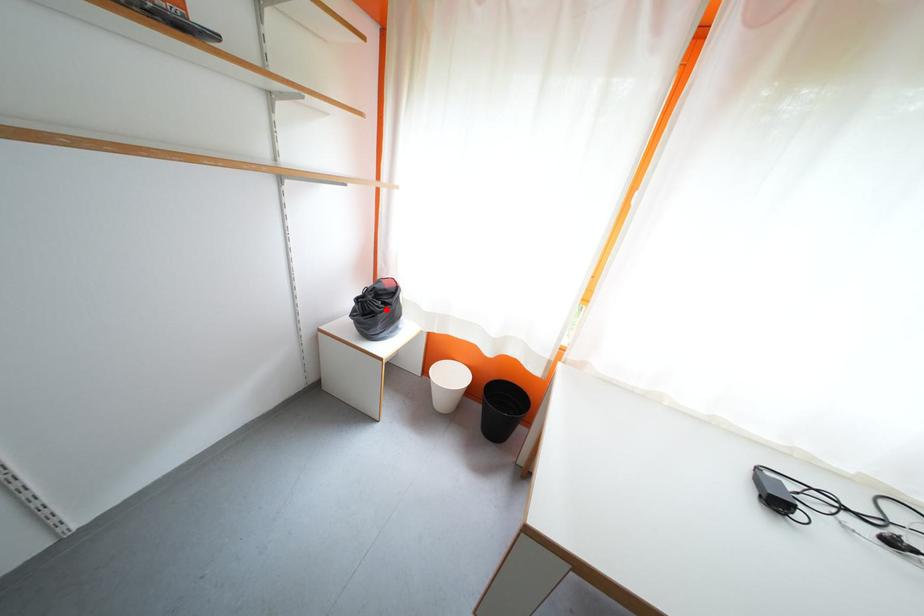
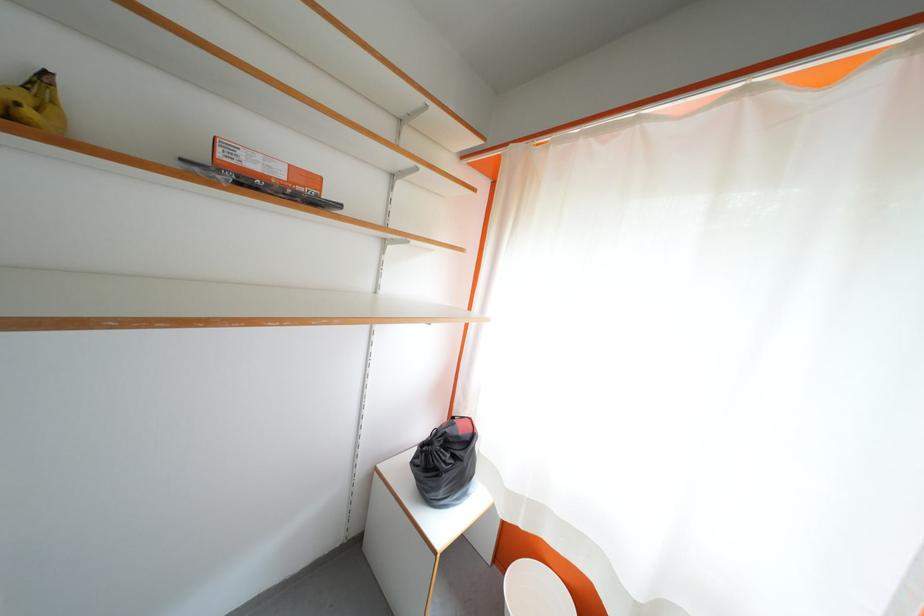
Question: A red point is marked in image1. In image2, is the corresponding 3D point closer to the camera or farther? Reply with the corresponding letter.

Choices:
 (A) The corresponding 3D point is closer.
 (B) The corresponding 3D point is farther.

Answer: (B)